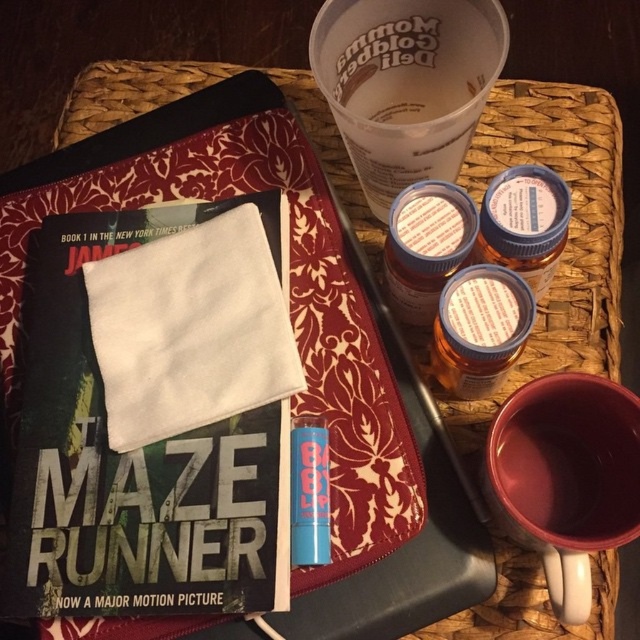
You are organizing items on a tray and need to stack the hardcover book at center and the matte ceramic mug at lower right. Which item should you place at the bottom to ensure stability?

You should place the hardcover book at center at the bottom because it is much taller than the matte ceramic mug at lower right, providing a stable base.